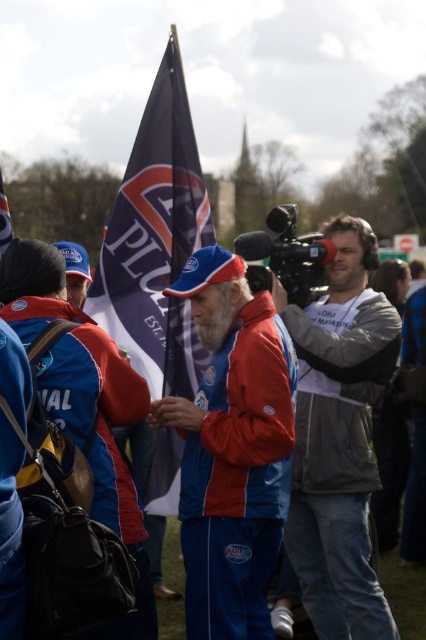
You are a photographer at the event and want to capture both the red jacket at center and the blue fabric flag at upper center in a single shot. Considering their sizes, which object should you focus on to ensure both are clearly visible in the frame?

Since the red jacket at center is bigger than the blue fabric flag at upper center, you should focus on the red jacket at center to ensure both are clearly visible in the frame.

You are a photographer trying to capture both the blue fabric flag at center and the blue fabric flag at upper center in a single shot. Which flag should you adjust your camera angle to focus on first if you want to include both in the frame?

The blue fabric flag at upper center is positioned to the left of the blue fabric flag at center, so you should focus on the blue fabric flag at upper center first to ensure both are in the frame.